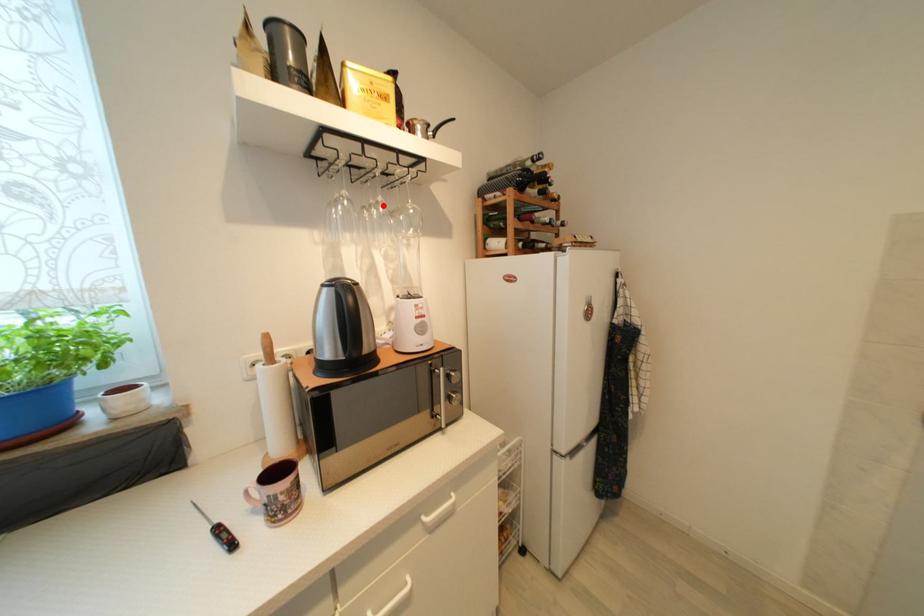
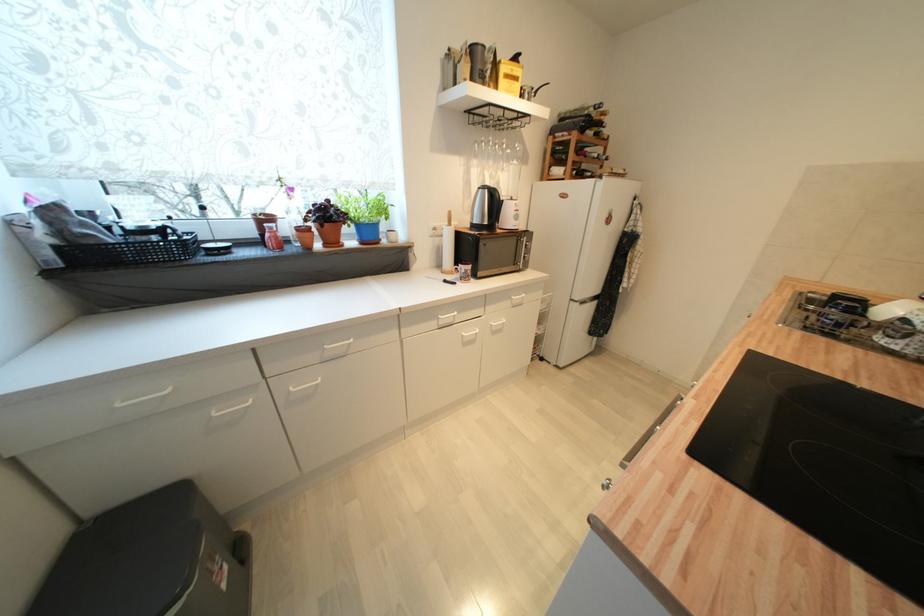
Question: I am providing you with two images of the same scene from different viewpoints. A red point is marked on the first image. Is the red point's position out of view in image 2?

Choices:
 (A) Yes
 (B) No

Answer: (B)